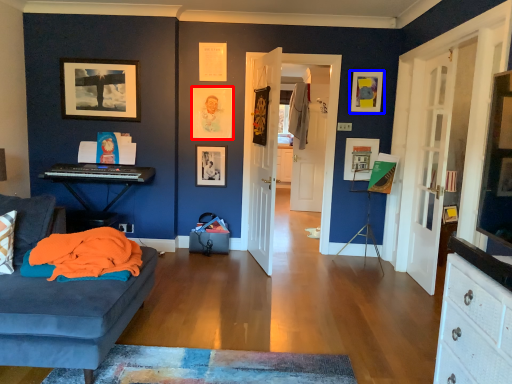
Question: Which object appears farthest to the camera in this image, picture frame (highlighted by a red box) or picture frame (highlighted by a blue box)?

Choices:
 (A) picture frame
 (B) picture frame

Answer: (A)